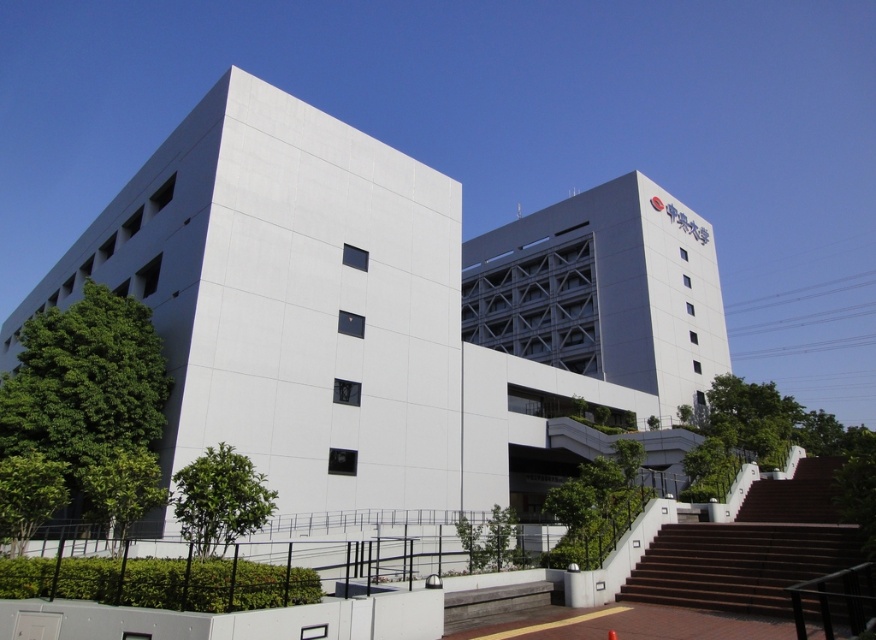
You are a delivery drone with a wingspan of 1.2 meters. You need to fly from the white smooth building at center to the brown wooden stairs at lower right. Is there enough space between them for your drone to pass through without touching either structure?

The distance between the white smooth building at center and the brown wooden stairs at lower right is 17.53 meters. Since the drone has a wingspan of 1.2 meters, there is ample space for it to pass through without any issues.

You are standing in the middle of the modern architectural scene between the two buildings. You see two points marked as point (x=555, y=355) and point (x=792, y=502). Which point is closer to you?

Point (x=555, y=355) is closer to you because it is further to the viewer than point (x=792, y=502).